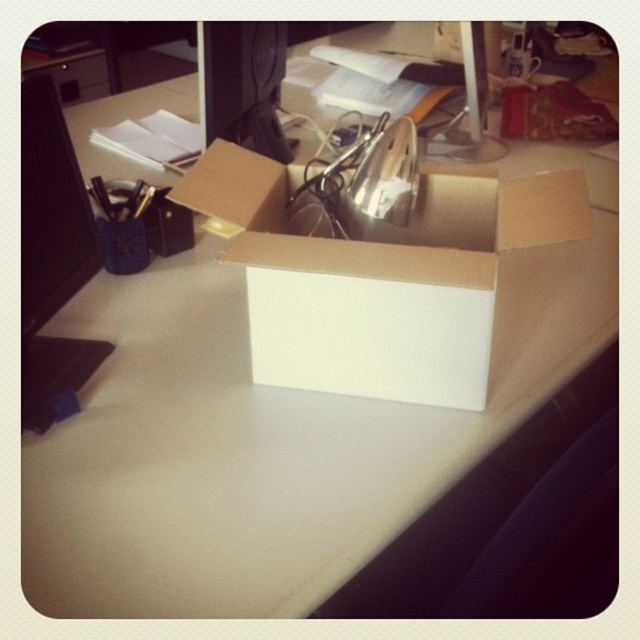
Does point (61, 296) lie behind point (234, 128)?

No.

Can you confirm if black glossy computer monitor at left is thinner than matte black monitor at upper center?

Indeed, black glossy computer monitor at left has a lesser width compared to matte black monitor at upper center.

Find the location of a particular element. The height and width of the screenshot is (640, 640). black glossy computer monitor at left is located at coordinates (52, 259).

Between brown cardboard box at center and black glossy computer monitor at left, which one appears on the right side from the viewer's perspective?

Positioned to the right is brown cardboard box at center.

Is point (474, 195) positioned in front of point (61, 147)?

No, it is behind (61, 147).

The image size is (640, 640). Find the location of `brown cardboard box at center`. brown cardboard box at center is located at coordinates (380, 276).

Is point (481, 186) farther from viewer compared to point (214, 61)?

That is False.

What do you see at coordinates (380, 276) in the screenshot? I see `brown cardboard box at center` at bounding box center [380, 276].

Does point (493, 310) lie behind point (204, 116)?

No, (493, 310) is closer to viewer.

At what (x,y) coordinates should I click in order to perform the action: click on brown cardboard box at center. Please return your answer as a coordinate pair (x, y). This screenshot has height=640, width=640. Looking at the image, I should click on (380, 276).